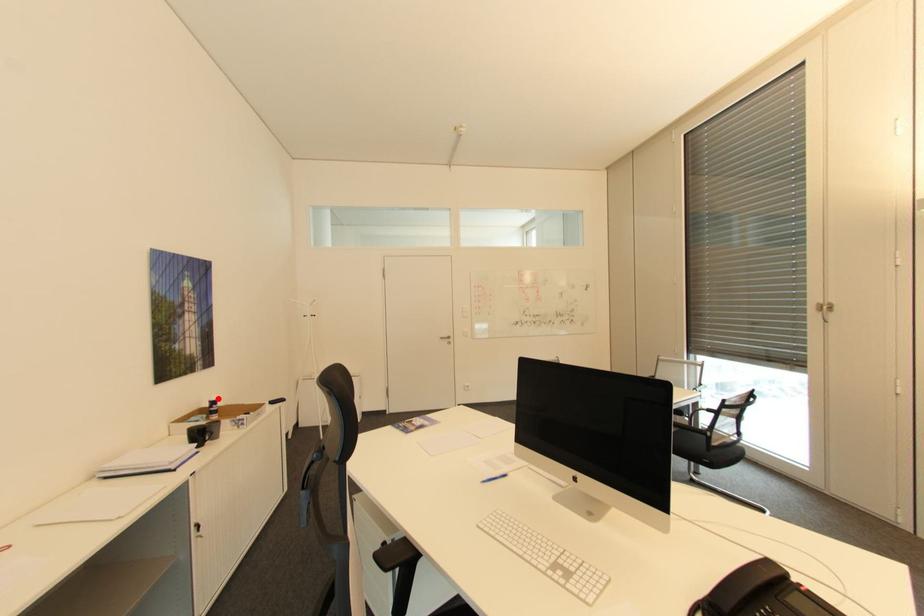
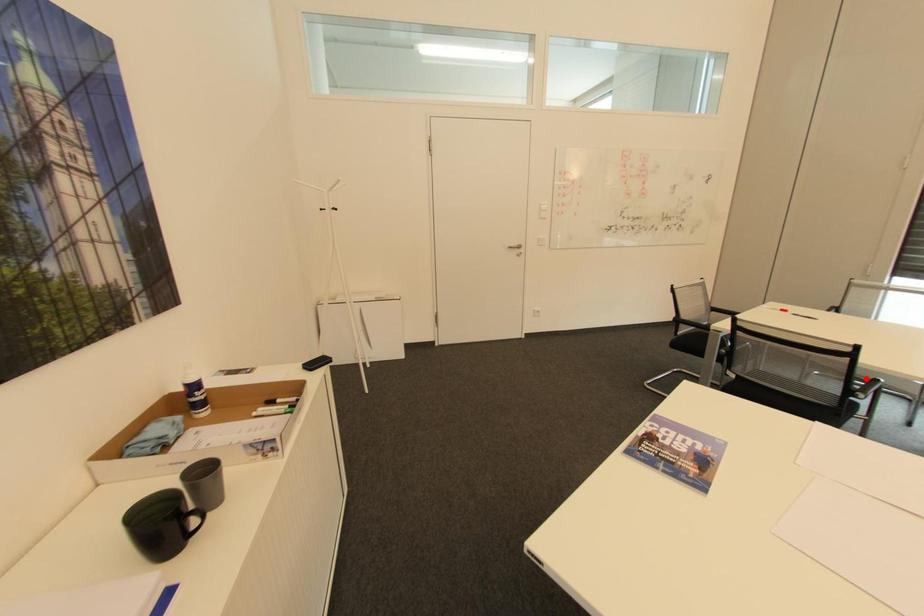
Looking at this image, I am providing you with two images of the same scene from different viewpoints. A red point is marked on the first image and another point is marked on the second image. Are the points marked in image1 and image2 representing the same 3D position?

No